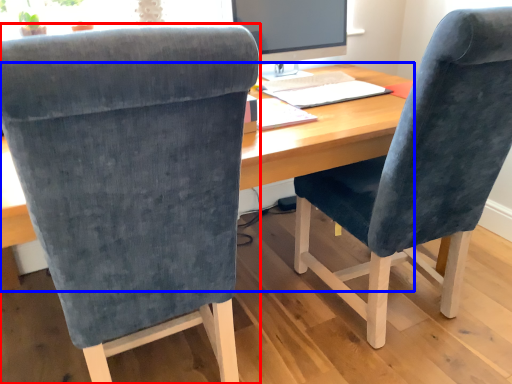
Question: Which object appears closest to the camera in this image, chair (highlighted by a red box) or desk (highlighted by a blue box)?

Choices:
 (A) chair
 (B) desk

Answer: (A)